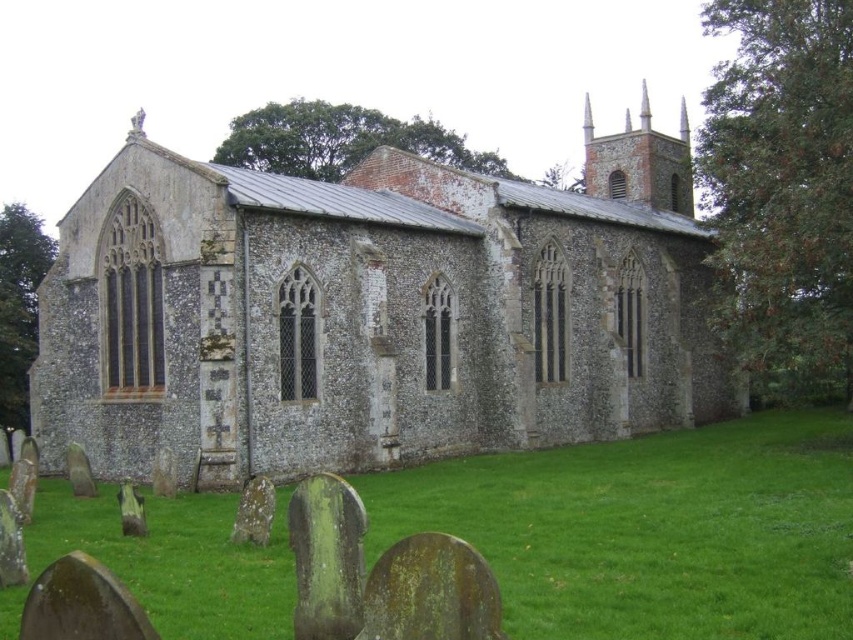
Question: Which object is closer to the camera taking this photo?

Choices:
 (A) green grass at lower center
 (B) speckled stone church at center

Answer: (A)

Question: Can you confirm if speckled stone church at center is positioned above green grass at lower center?

Choices:
 (A) yes
 (B) no

Answer: (A)

Question: From the image, what is the correct spatial relationship of speckled stone church at center in relation to green grass at lower center?

Choices:
 (A) below
 (B) above

Answer: (B)

Question: Which object appears farthest from the camera in this image?

Choices:
 (A) green grass at lower center
 (B) speckled stone church at center

Answer: (B)

Question: Can you confirm if speckled stone church at center is positioned to the right of green grass at lower center?

Choices:
 (A) yes
 (B) no

Answer: (A)